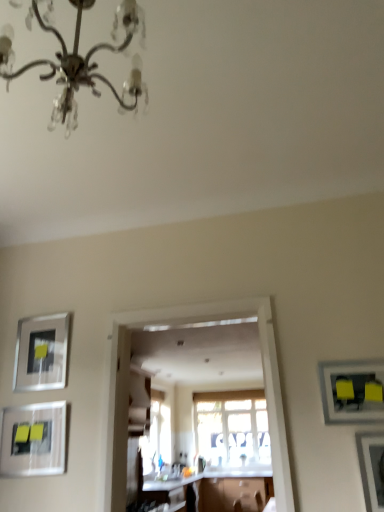
Question: Is metallic silver picture frame at lower right, which ranks as the 4th picture frame in left-to-right order, smaller than silver metallic chandelier at upper center?

Choices:
 (A) no
 (B) yes

Answer: (B)

Question: Is metallic silver picture frame at lower right, which ranks as the 4th picture frame in left-to-right order, aimed at silver metallic chandelier at upper center?

Choices:
 (A) no
 (B) yes

Answer: (A)

Question: Is metallic silver picture frame at lower right, which ranks as the 4th picture frame in left-to-right order, thinner than silver metallic chandelier at upper center?

Choices:
 (A) yes
 (B) no

Answer: (A)

Question: From a real-world perspective, is metallic silver picture frame at lower right, which ranks as the 4th picture frame in left-to-right order, beneath silver metallic chandelier at upper center?

Choices:
 (A) yes
 (B) no

Answer: (A)

Question: Can you confirm if metallic silver picture frame at lower right, placed as the 1th picture frame when sorted from right to left, is wider than silver metallic chandelier at upper center?

Choices:
 (A) yes
 (B) no

Answer: (B)

Question: From their relative heights in the image, would you say transparent glass door at center is taller or shorter than silver metallic chandelier at upper center?

Choices:
 (A) tall
 (B) short

Answer: (A)

Question: Considering the positions of transparent glass door at center and silver metallic chandelier at upper center in the image, is transparent glass door at center wider or thinner than silver metallic chandelier at upper center?

Choices:
 (A) thin
 (B) wide

Answer: (A)

Question: In the image, is transparent glass door at center on the left side or the right side of silver metallic chandelier at upper center?

Choices:
 (A) right
 (B) left

Answer: (A)

Question: Is point (124, 420) positioned closer to the camera than point (137, 74)?

Choices:
 (A) closer
 (B) farther

Answer: (B)

Question: Is point click(x=374, y=372) positioned closer to the camera than point click(x=23, y=476)?

Choices:
 (A) farther
 (B) closer

Answer: (B)

Question: From the image's perspective, is matte black picture frame at right, marked as the third picture frame in a left-to-right arrangement, located above or below matte silver picture frame at lower left, the third picture frame from the right?

Choices:
 (A) below
 (B) above

Answer: (B)

Question: In the image, is matte black picture frame at right, which is the third picture frame in back-to-front order, positioned in front of or behind matte silver picture frame at lower left, which appears as the 3th picture frame when viewed from the front?

Choices:
 (A) front
 (B) behind

Answer: (A)

Question: From a real-world perspective, is matte black picture frame at right, the second picture frame in the front-to-back sequence, above or below matte silver picture frame at lower left, which is counted as the second picture frame, starting from the back?

Choices:
 (A) above
 (B) below

Answer: (A)

Question: From a real-world perspective, relative to metallic silver picture frame at lower right, acting as the first picture frame starting from the front, is translucent glass window at center vertically above or below?

Choices:
 (A) above
 (B) below

Answer: (A)

Question: Is translucent glass window at center taller or shorter than metallic silver picture frame at lower right, which is counted as the 4th picture frame, starting from the back?

Choices:
 (A) tall
 (B) short

Answer: (A)